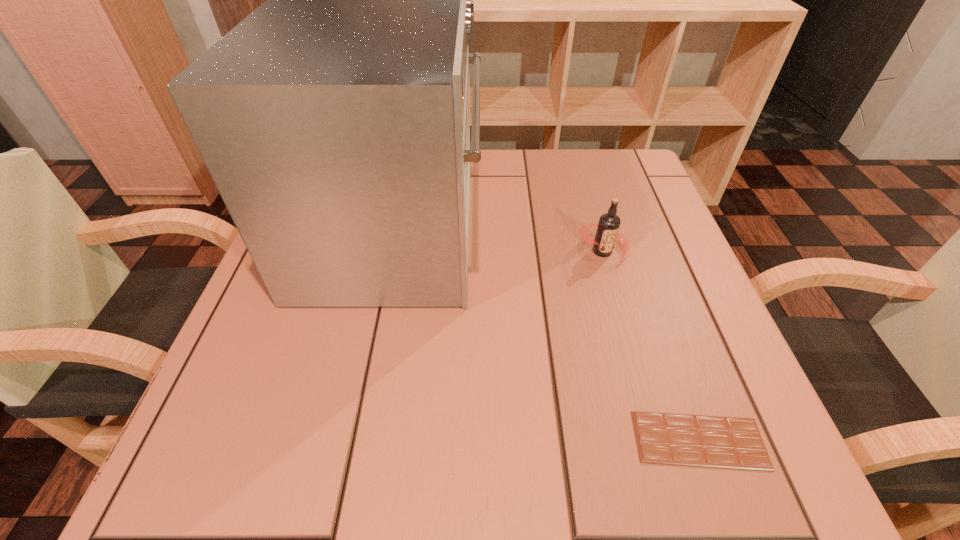
The width and height of the screenshot is (960, 540). Find the location of `object that is at the left edge`. object that is at the left edge is located at coordinates (334, 120).

Where is `root beer at the right edge`? root beer at the right edge is located at coordinates (609, 223).

This screenshot has width=960, height=540. What are the coordinates of `chocolate bar that is at the right edge` in the screenshot? It's located at (662, 438).

Where is `object that is at the far left corner`? The height and width of the screenshot is (540, 960). object that is at the far left corner is located at coordinates (334, 120).

Find the location of a particular element. The width and height of the screenshot is (960, 540). object that is at the near right corner is located at coordinates 662,438.

Where is `free space at the far edge of the desktop`? The height and width of the screenshot is (540, 960). free space at the far edge of the desktop is located at coordinates (573, 189).

The width and height of the screenshot is (960, 540). Find the location of `free region at the left edge of the desktop`. free region at the left edge of the desktop is located at coordinates (252, 388).

You are a GUI agent. You are given a task and a screenshot of the screen. Output one action in this format:
    pyautogui.click(x=<x>, y=<y>)
    Task: Click on the free space at the right edge of the desktop
    
    Given the screenshot: What is the action you would take?
    pyautogui.click(x=622, y=290)

What are the coordinates of `free space at the near left corner of the desktop` in the screenshot? It's located at (212, 440).

The image size is (960, 540). In the image, there is a desktop. What are the coordinates of `blank space at the far right corner` in the screenshot? It's located at (649, 192).